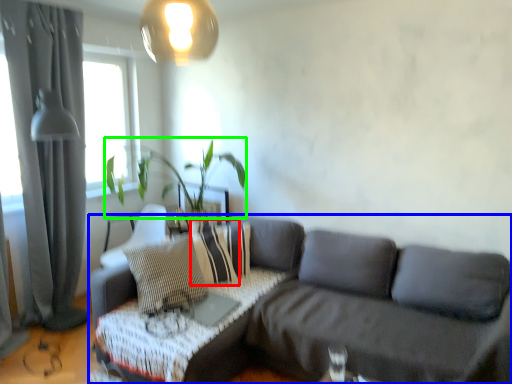
Question: Based on their relative distances, which object is farther from pillow (highlighted by a red box)? Choose from studio couch (highlighted by a blue box) and plant (highlighted by a green box).

Choices:
 (A) studio couch
 (B) plant

Answer: (B)